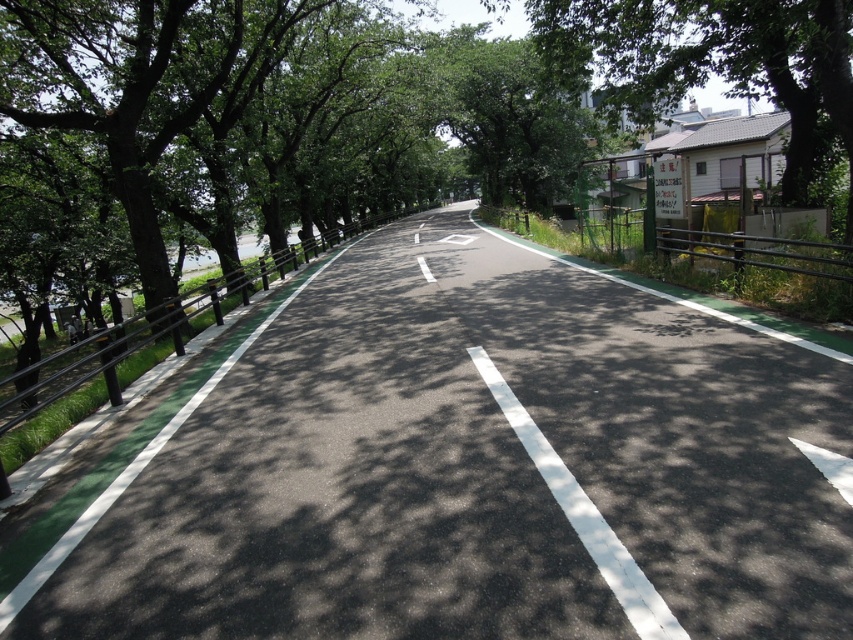
You are a delivery driver approaching the intersection and see the asphalt at left and the white asphalt road at center. Which one is located to the left of the other?

The asphalt at left is positioned on the left side of white asphalt road at center.

You are a pedestrian standing on the road and see the asphalt at left and the green leafy tree at upper right. Which object takes up more space in the image?

The green leafy tree at upper right takes up more space in the image than the asphalt at left.

You are a delivery driver who needs to park your truck on the asphalt at left without blocking the white asphalt road at center. Given that your truck is 8 feet wide, can you safely park there?

The asphalt at left and white asphalt road at center are 8.39 feet apart. Since the truck is 8 feet wide, it can fit within the space as there is enough width to park without blocking the white asphalt road at center.